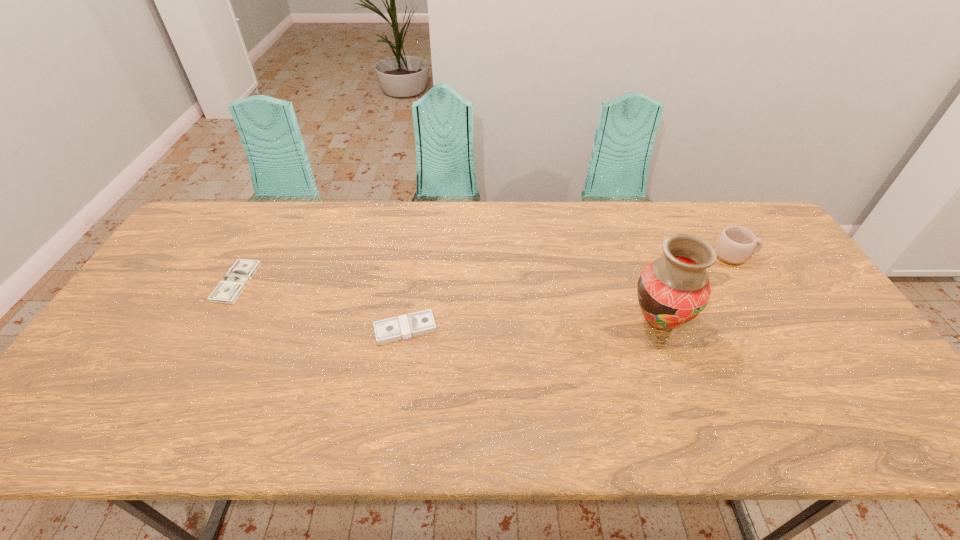
This screenshot has width=960, height=540. What are the coordinates of `vase` in the screenshot? It's located at (672, 290).

Where is `the tallest object`? The image size is (960, 540). the tallest object is located at coordinates (672, 290).

Identify the location of the rightmost object. This screenshot has width=960, height=540. coord(734,245).

The height and width of the screenshot is (540, 960). In order to click on the second tallest object in this screenshot , I will do 734,245.

Where is `the right dollar`? the right dollar is located at coordinates (401, 327).

Identify the location of the nearer dollar. This screenshot has height=540, width=960. (x=401, y=327).

Identify the location of the shortest object. This screenshot has width=960, height=540. (230, 287).

Where is `the farther dollar`? the farther dollar is located at coordinates (230, 287).

Image resolution: width=960 pixels, height=540 pixels. What are the coordinates of `free spot located on the left of the third object from left to right` in the screenshot? It's located at (490, 321).

At what (x,y) coordinates should I click in order to perform the action: click on free space located on the right of the nearer dollar. Please return your answer as a coordinate pair (x, y). The width and height of the screenshot is (960, 540). Looking at the image, I should click on (570, 328).